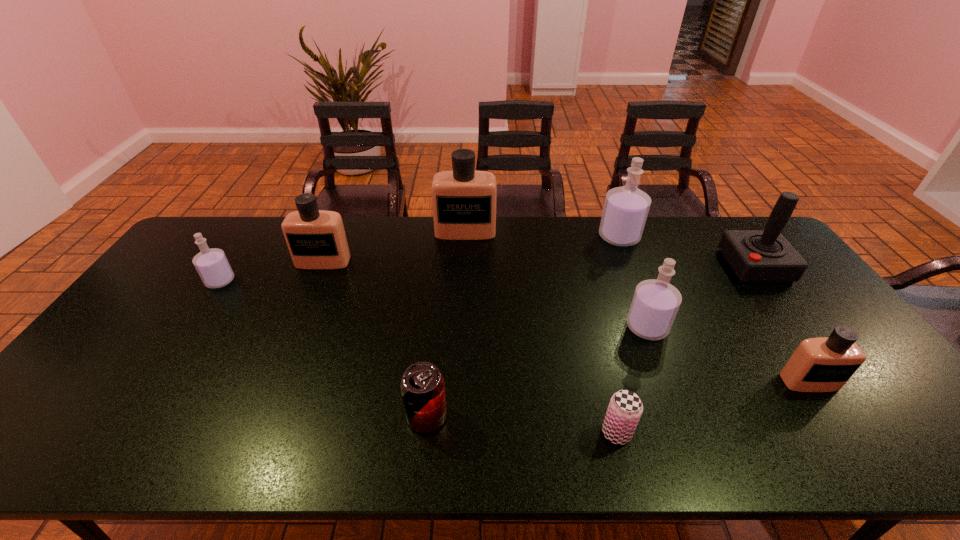
Locate an element on the screen. vacant space situated 0.240m on the front of the second biggest purple perfume is located at coordinates (684, 423).

The height and width of the screenshot is (540, 960). What are the coordinates of `vacant space located 0.050m on the front label of the eighth object from right to left` in the screenshot? It's located at (315, 280).

In order to click on free region located on the front of the leftmost object in this screenshot , I will do `click(184, 335)`.

This screenshot has width=960, height=540. Find the location of `free spot located 0.150m on the front label of the nearest beige perfume`. free spot located 0.150m on the front label of the nearest beige perfume is located at coordinates (856, 451).

This screenshot has height=540, width=960. Identify the location of free spot located on the right of the eighth tallest object. (494, 416).

The image size is (960, 540). Find the location of `free spot located on the back of the purple beer can`. free spot located on the back of the purple beer can is located at coordinates (589, 324).

Locate an element on the screen. This screenshot has width=960, height=540. joystick that is at the far edge is located at coordinates (765, 255).

You are a GUI agent. You are given a task and a screenshot of the screen. Output one action in this format:
    pyautogui.click(x=<x>, y=<y>)
    Task: Click on the soda can located at the near edge
    This screenshot has width=960, height=540.
    Given the screenshot: What is the action you would take?
    pyautogui.click(x=422, y=386)

Find the location of a particular element. This screenshot has height=540, width=960. beer can that is at the near edge is located at coordinates (625, 408).

Where is `object that is at the left edge`? This screenshot has height=540, width=960. object that is at the left edge is located at coordinates (212, 265).